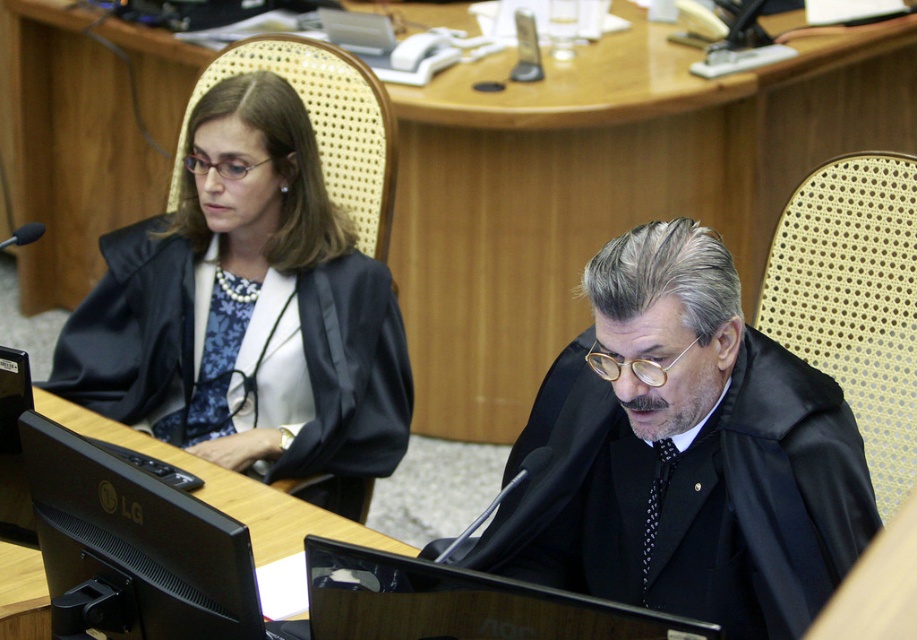
Can you confirm if satin black robe at left is thinner than black matte robe at center?

Incorrect, satin black robe at left's width is not less than black matte robe at center's.

Measure the distance between point (344, 396) and camera.

9.02 feet

Does point (306, 113) lie behind point (609, 426)?

Yes, point (306, 113) is farther from viewer.

This screenshot has width=917, height=640. Identify the location of satin black robe at left. (249, 314).